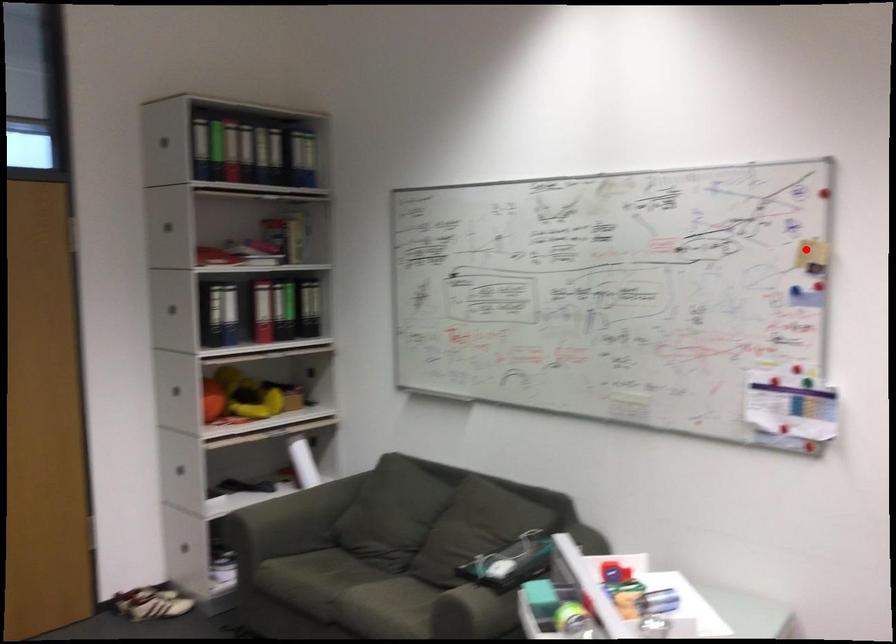
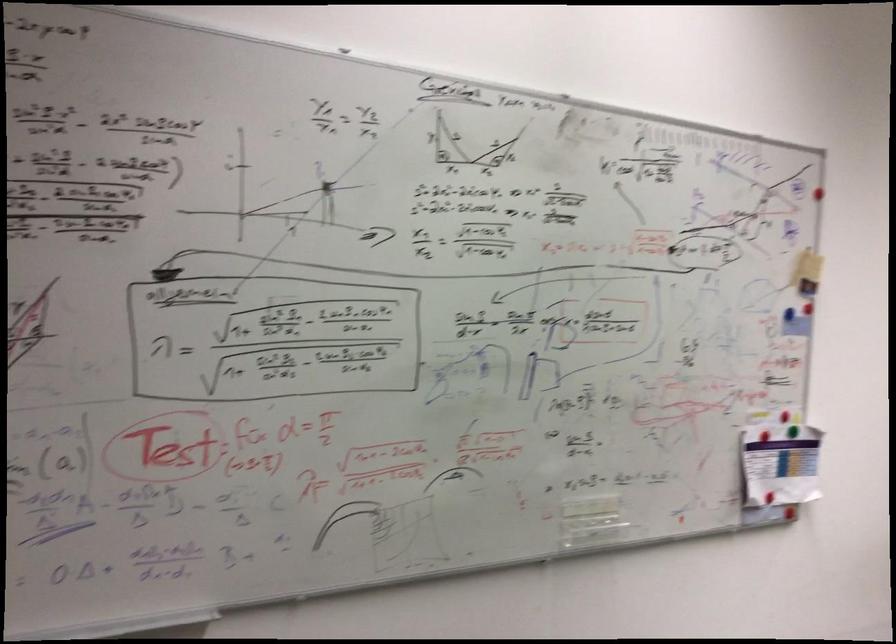
In the second image, find the point that corresponds to the highlighted location in the first image.

(805, 267)